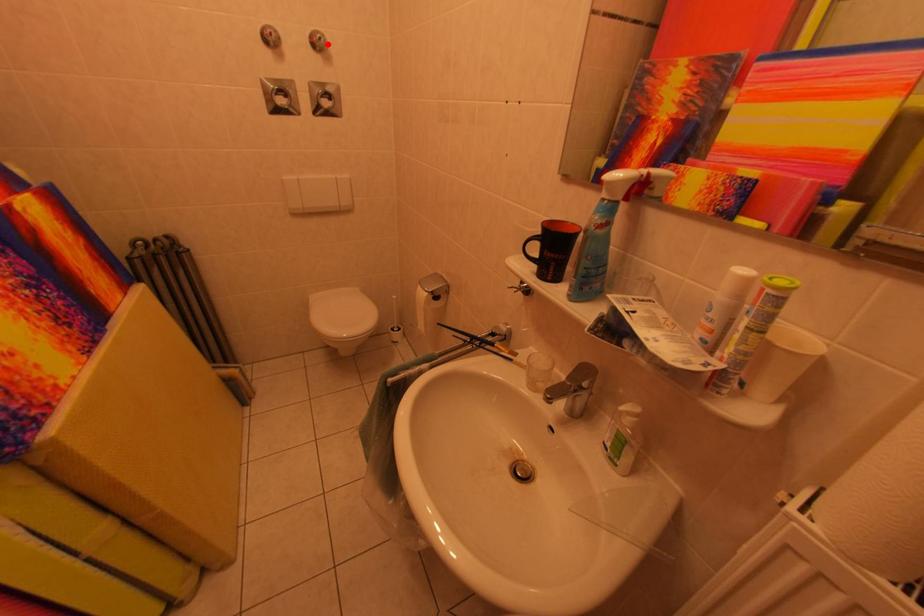
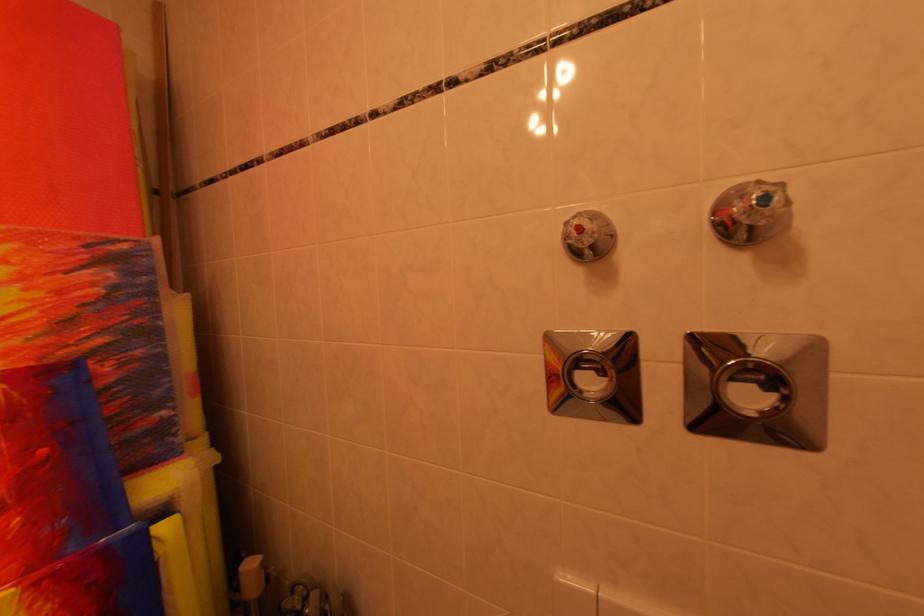
Question: I am providing you with two images of the same scene from different viewpoints. A red point is marked on the first image. At the location where the point appears in image 1, is it still visible in image 2?

Choices:
 (A) Yes
 (B) No

Answer: (A)